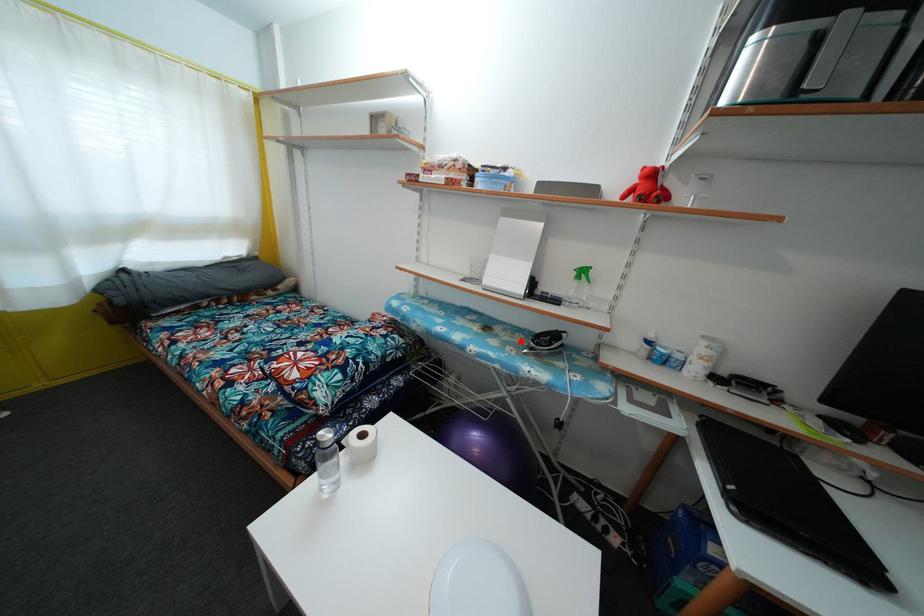
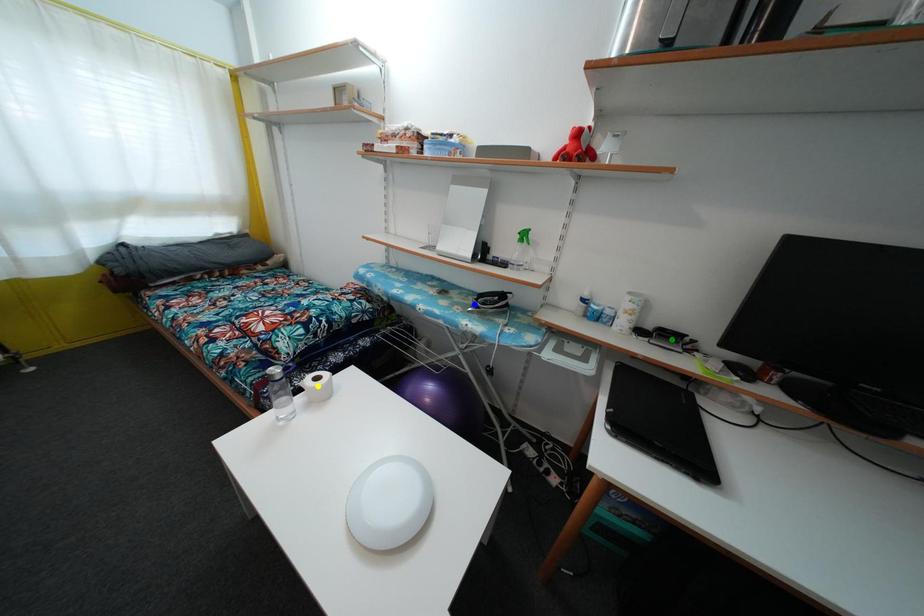
Question: I am providing you with two images of the same scene from different viewpoints. A red point is marked on the first image. You are given multiple points on the second image. Which point in image 2 represents the same 3d spot as the red point in image 1?

Choices:
 (A) yellow point
 (B) blue point
 (C) green point

Answer: (B)